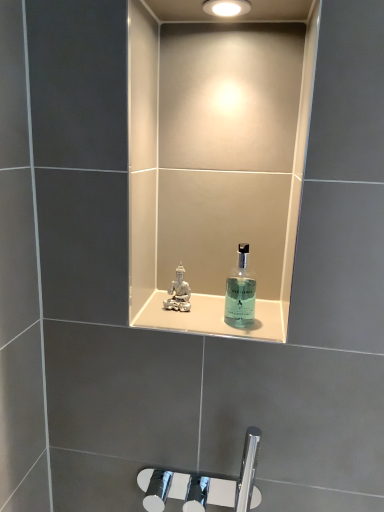
Identify the location of vacant space behind transparent glass bottle at center. The image size is (384, 512). (235, 310).